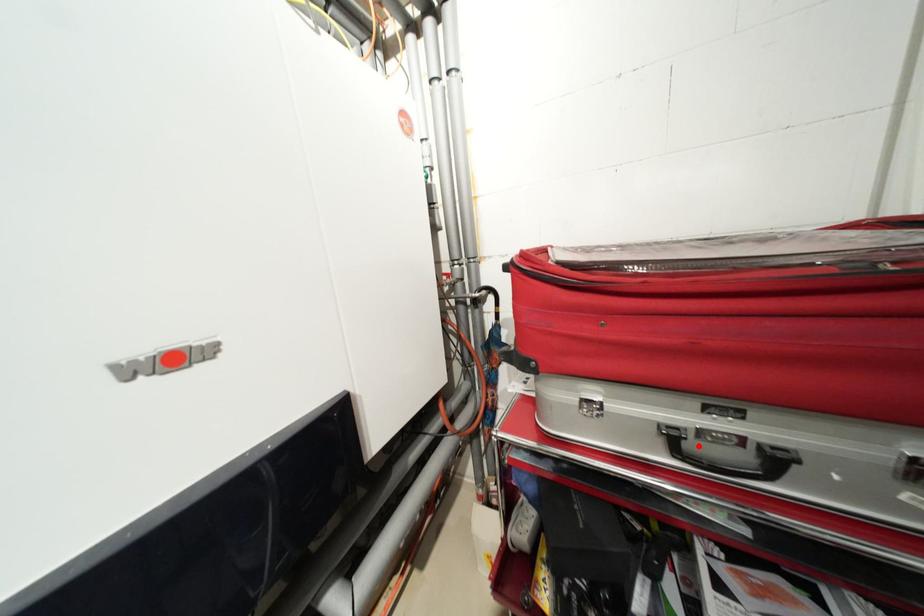
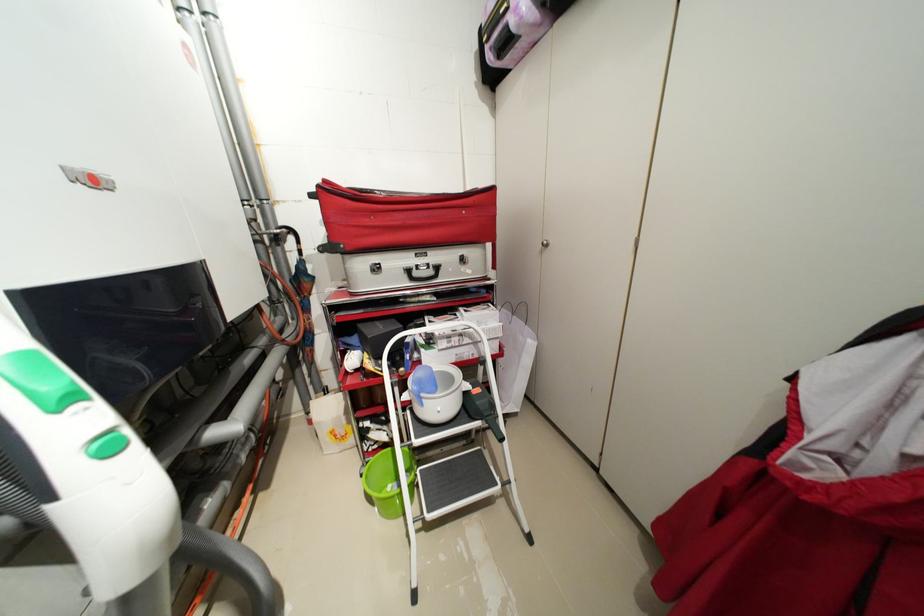
Find the pixel in the second image that matches the highlighted location in the first image.

(422, 275)